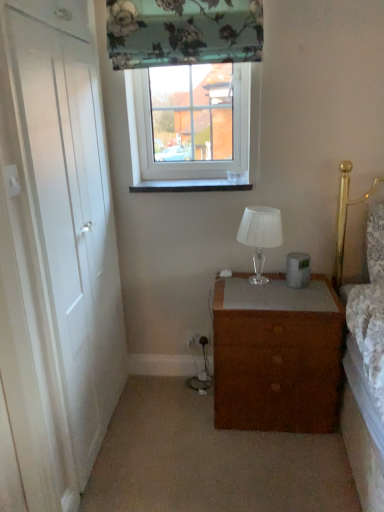
This screenshot has width=384, height=512. What do you see at coordinates (183, 32) in the screenshot?
I see `floral fabric curtain at upper center` at bounding box center [183, 32].

Where is `white glossy window sill at center`? The width and height of the screenshot is (384, 512). white glossy window sill at center is located at coordinates (192, 185).

What do you see at coordinates (260, 234) in the screenshot? The width and height of the screenshot is (384, 512). I see `white glass lamp at center` at bounding box center [260, 234].

Find the location of a particular element. This screenshot has width=384, height=512. white glass lamp at center is located at coordinates 260,234.

Describe the element at coordinates (66, 218) in the screenshot. I see `white wooden door at left` at that location.

Identify the location of floral fabric curtain at upper center. The width and height of the screenshot is (384, 512). (183, 32).

Between white glass lamp at center and white glossy window sill at center, which one appears on the left side from the viewer's perspective?

white glossy window sill at center.

Is white glass lamp at center positioned far away from white glossy window sill at center?

No, white glass lamp at center is not far from white glossy window sill at center.

Is white glass lamp at center not within white glossy window sill at center?

Indeed, white glass lamp at center is completely outside white glossy window sill at center.

What are the coordinates of `lamp lying below the white glossy window sill at center (from the image's perspective)` in the screenshot? It's located at (260, 234).

Is white wooden door at left directly adjacent to white glass lamp at center?

No, white wooden door at left is not making contact with white glass lamp at center.

Considering the points (96, 320) and (252, 283), which point is behind, point (96, 320) or point (252, 283)?

The point (252, 283) is farther.

Considering the relative sizes of white wooden door at left and white glass lamp at center in the image provided, is white wooden door at left shorter than white glass lamp at center?

No, white wooden door at left is not shorter than white glass lamp at center.

Is white wooden door at left bigger or smaller than white glass lamp at center?

Considering their sizes, white wooden door at left takes up more space than white glass lamp at center.

Is clear glass window at upper center bigger than floral fabric curtain at upper center?

Yes.

Is point (210, 120) closer to camera compared to point (193, 20)?

No, it is behind (193, 20).

From the picture: Between clear glass window at upper center and floral fabric curtain at upper center, which one has larger width?

floral fabric curtain at upper center.

From the picture: Which is closer, (92, 267) or (232, 134)?

The point (92, 267) is closer.

Relative to clear glass window at upper center, is white wooden door at left in front or behind?

white wooden door at left is positioned closer to the viewer than clear glass window at upper center.

Locate an element on the screen. The width and height of the screenshot is (384, 512). curtain in front of the white glossy window sill at center is located at coordinates (183, 32).

Considering the relative sizes of white glossy window sill at center and floral fabric curtain at upper center in the image provided, is white glossy window sill at center wider than floral fabric curtain at upper center?

Indeed, white glossy window sill at center has a greater width compared to floral fabric curtain at upper center.

Are white glossy window sill at center and floral fabric curtain at upper center making contact?

white glossy window sill at center is not next to floral fabric curtain at upper center, and they're not touching.

Can you confirm if white glossy window sill at center is shorter than floral fabric curtain at upper center?

Correct, white glossy window sill at center is not as tall as floral fabric curtain at upper center.

Considering the relative sizes of clear glass window at upper center and brown matte chest of drawers at center in the image provided, is clear glass window at upper center smaller than brown matte chest of drawers at center?

Correct, clear glass window at upper center occupies less space than brown matte chest of drawers at center.

Is clear glass window at upper center positioned far away from brown matte chest of drawers at center?

Yes.

Is clear glass window at upper center oriented away from brown matte chest of drawers at center?

No, clear glass window at upper center's orientation is not away from brown matte chest of drawers at center.

Where is `lamp lying below the floral fabric curtain at upper center (from the image's perspective)`? lamp lying below the floral fabric curtain at upper center (from the image's perspective) is located at coordinates (260, 234).

Which of these two, floral fabric curtain at upper center or white glass lamp at center, is wider?

white glass lamp at center.

Visually, is floral fabric curtain at upper center positioned to the left or to the right of white glass lamp at center?

floral fabric curtain at upper center is to the left of white glass lamp at center.

Is floral fabric curtain at upper center behind white glass lamp at center?

No, the depth of floral fabric curtain at upper center is less than that of white glass lamp at center.

Locate an element on the screen. window sill behind the white glass lamp at center is located at coordinates (192, 185).

At what (x,y) coordinates should I click in order to perform the action: click on door lying above the white glass lamp at center (from the image's perspective). Please return your answer as a coordinate pair (x, y). Looking at the image, I should click on (66, 218).

Estimate the real-world distances between objects in this image. Which object is further from white glossy window sill at center, floral fabric curtain at upper center or clear glass window at upper center?

floral fabric curtain at upper center is positioned further to the anchor white glossy window sill at center.

Looking at the image, which one is located further to white glass lamp at center, clear glass window at upper center or white wooden door at left?

white wooden door at left is further to white glass lamp at center.

Estimate the real-world distances between objects in this image. Which object is further from floral fabric curtain at upper center, white glossy window sill at center or white glass lamp at center?

Among the two, white glass lamp at center is located further to floral fabric curtain at upper center.

Looking at the image, which one is located further to white glass lamp at center, clear glass window at upper center or brown matte chest of drawers at center?

Based on the image, clear glass window at upper center appears to be further to white glass lamp at center.

From the image, which object appears to be farther from floral fabric curtain at upper center, white wooden door at left or white glossy window sill at center?

white wooden door at left.

Based on their spatial positions, is white wooden door at left or floral fabric curtain at upper center closer to white glossy window sill at center?

Among the two, floral fabric curtain at upper center is located nearer to white glossy window sill at center.

Looking at the image, which one is located further to floral fabric curtain at upper center, brown matte chest of drawers at center or white wooden door at left?

brown matte chest of drawers at center is positioned further to the anchor floral fabric curtain at upper center.

Based on their spatial positions, is floral fabric curtain at upper center or white glossy window sill at center further from white wooden door at left?

white glossy window sill at center.

In order to click on lamp between white wooden door at left and clear glass window at upper center from front to back in this screenshot , I will do `click(260, 234)`.

I want to click on door that lies between clear glass window at upper center and brown matte chest of drawers at center from top to bottom, so click(x=66, y=218).

Locate an element on the screen. door between floral fabric curtain at upper center and white glass lamp at center in the up-down direction is located at coordinates (66, 218).

At what (x,y) coordinates should I click in order to perform the action: click on window screen that lies between floral fabric curtain at upper center and brown matte chest of drawers at center from top to bottom. Please return your answer as a coordinate pair (x, y). The image size is (384, 512). Looking at the image, I should click on coord(192,112).